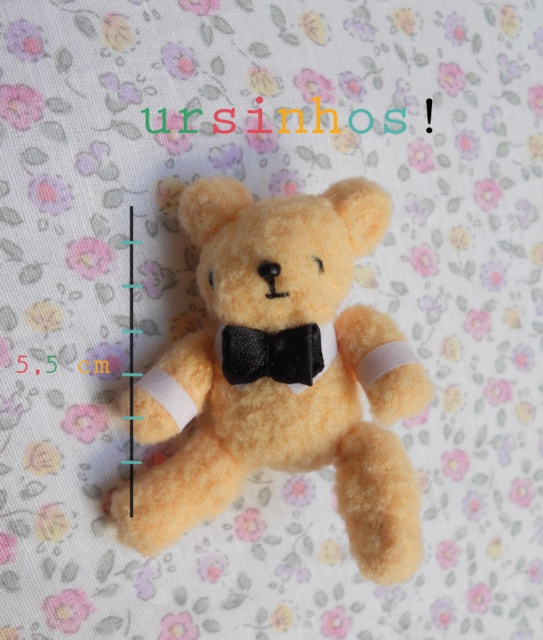
Is fuzzy yellow teddy bear at center to the left of black satin bow tie at center from the viewer's perspective?

Indeed, fuzzy yellow teddy bear at center is positioned on the left side of black satin bow tie at center.

Who is positioned more to the left, fuzzy yellow teddy bear at center or black satin bow tie at center?

From the viewer's perspective, fuzzy yellow teddy bear at center appears more on the left side.

Who is more forward, [370,451] or [318,346]?

Positioned in front is point [318,346].

The image size is (543, 640). Identify the location of fuzzy yellow teddy bear at center. (281, 374).